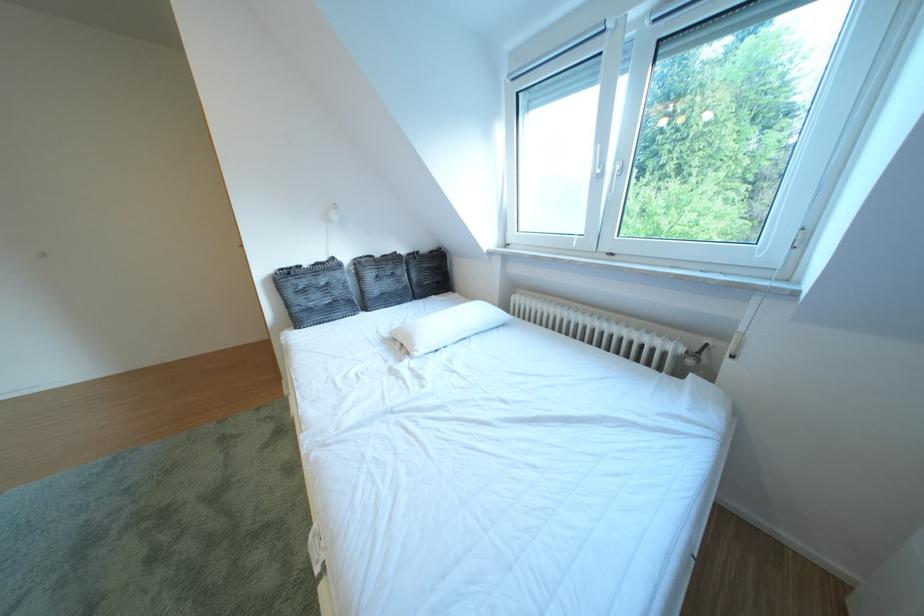
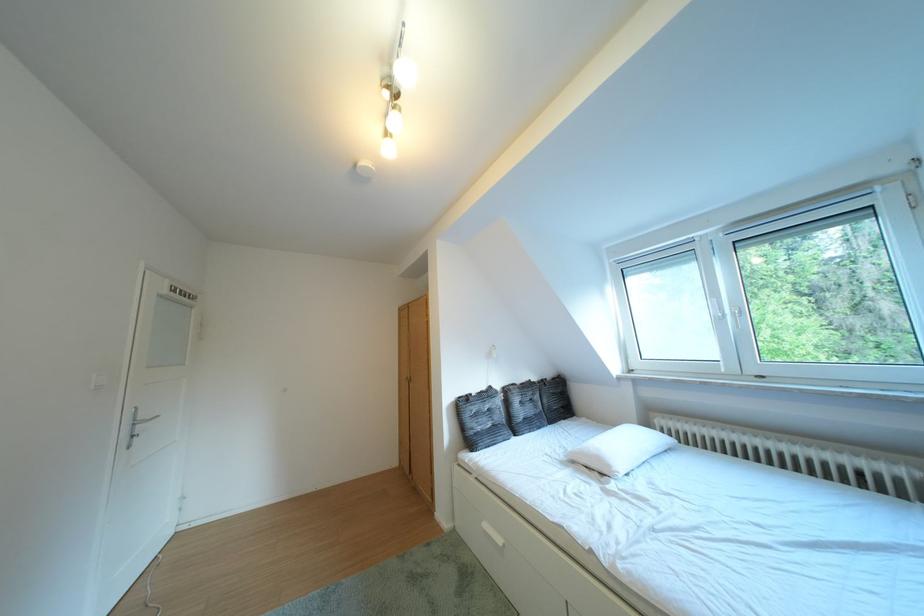
Find the pixel in the second image that matches the point at 427,350 in the first image.

(623, 471)